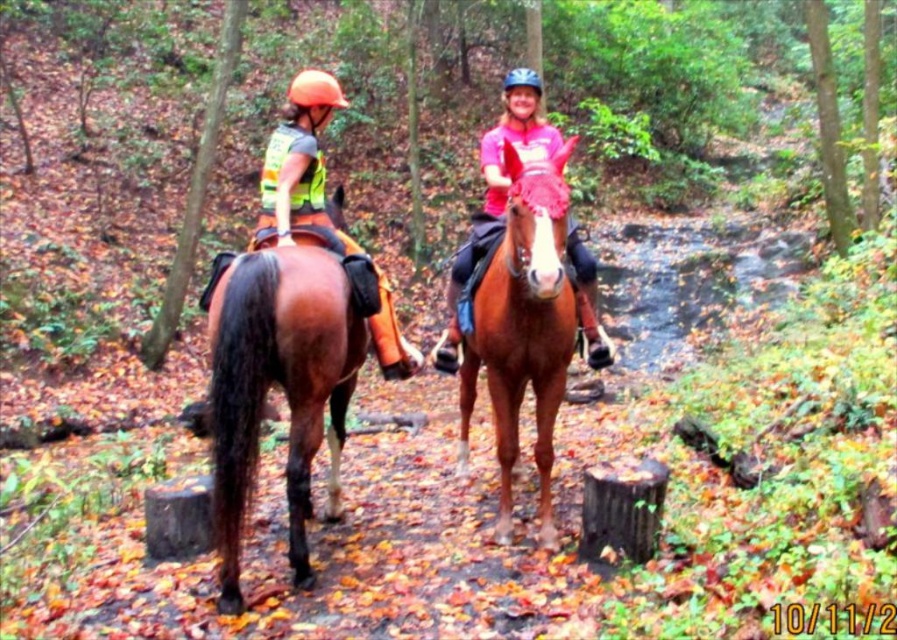
Does point (288, 538) lie behind point (580, 269)?

No, it is in front of (580, 269).

From the picture: Can you confirm if brown glossy horse at left is positioned below pink matte helmet at upper center?

Indeed, brown glossy horse at left is positioned under pink matte helmet at upper center.

In order to click on brown glossy horse at left in this screenshot , I will do `click(280, 385)`.

Based on the photo, between brown glossy horse at center and pink matte helmet at upper center, which one appears on the right side from the viewer's perspective?

From the viewer's perspective, pink matte helmet at upper center appears more on the right side.

Does brown glossy horse at center have a greater width compared to pink matte helmet at upper center?

No.

Measure the distance between brown glossy horse at center and camera.

They are 3.25 meters apart.

The image size is (897, 640). Identify the location of brown glossy horse at center. (521, 326).

Is point (242, 349) behind point (521, 358)?

No, (242, 349) is closer to viewer.

Who is positioned more to the left, brown glossy horse at left or brown glossy horse at center?

Positioned to the left is brown glossy horse at left.

Which is in front, point (323, 266) or point (567, 353)?

Positioned in front is point (323, 266).

At what (x,y) coordinates should I click in order to perform the action: click on brown glossy horse at left. Please return your answer as a coordinate pair (x, y). The width and height of the screenshot is (897, 640). Looking at the image, I should click on (280, 385).